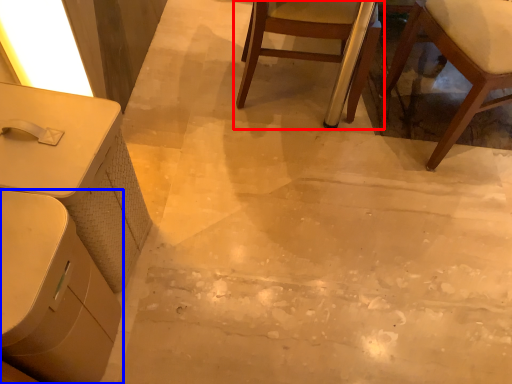
Question: Which of the following is the closest to the observer, chair (highlighted by a red box) or table (highlighted by a blue box)?

Choices:
 (A) chair
 (B) table

Answer: (B)